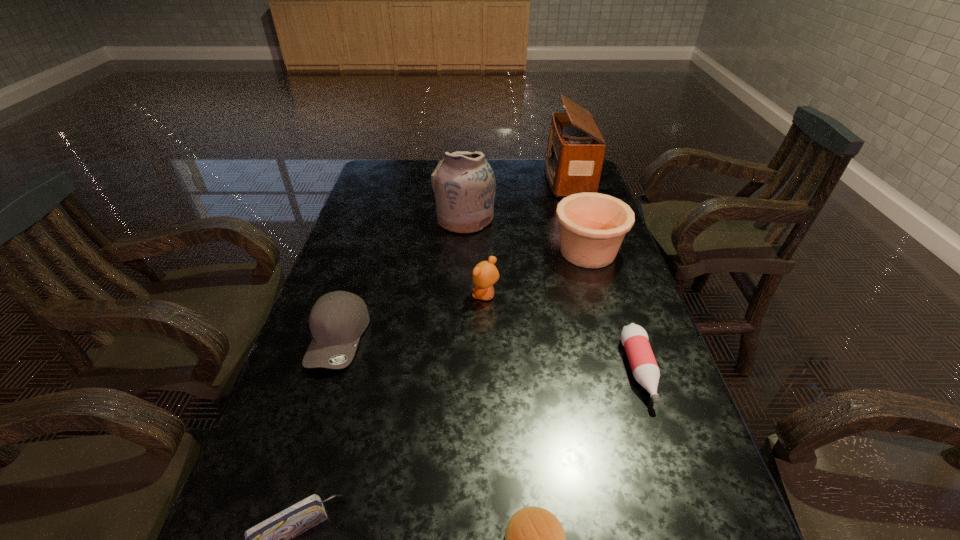
The height and width of the screenshot is (540, 960). I want to click on radio receiver, so click(575, 151).

I want to click on the taller pottery, so click(x=464, y=186).

You are a GUI agent. You are given a task and a screenshot of the screen. Output one action in this format:
    pyautogui.click(x=<x>, y=<y>)
    Task: Click on the shorter pottery
    
    Given the screenshot: What is the action you would take?
    pyautogui.click(x=592, y=225)

Locate an element on the screen. This screenshot has width=960, height=540. teddy bear is located at coordinates (485, 274).

Image resolution: width=960 pixels, height=540 pixels. I want to click on the fifth tallest object, so click(337, 320).

This screenshot has width=960, height=540. What are the coordinates of `the sixth tallest object` in the screenshot? It's located at (634, 338).

You are a GUI agent. You are given a task and a screenshot of the screen. Output one action in this format:
    pyautogui.click(x=<x>, y=<y>)
    Task: Click on the free location located on the front panel of the radio receiver
    This screenshot has width=960, height=540.
    Given the screenshot: What is the action you would take?
    pyautogui.click(x=498, y=178)

Find the location of a particular element. free space located on the front panel of the radio receiver is located at coordinates (495, 178).

The height and width of the screenshot is (540, 960). I want to click on free space located 0.270m on the front panel of the radio receiver, so click(473, 178).

The width and height of the screenshot is (960, 540). I want to click on vacant space positioned on the back of the left pottery, so click(467, 172).